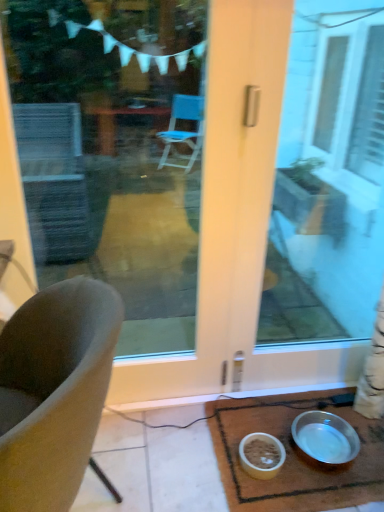
Where is `free space below silver metallic bowl at lower right, arranged as the 1th bowl when viewed from the right (from a real-world perspective)`? The width and height of the screenshot is (384, 512). free space below silver metallic bowl at lower right, arranged as the 1th bowl when viewed from the right (from a real-world perspective) is located at coordinates (313, 458).